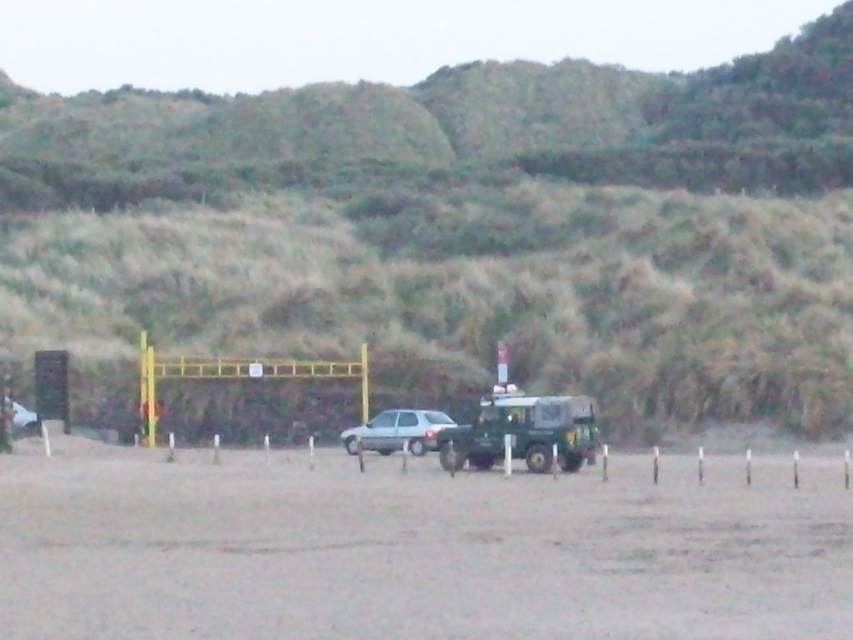
You need to park your car between the two vehicles in the image. The green matte jeep at center and the satin silver car at center. Which side should you park on to be between them?

To park between the green matte jeep at center and the satin silver car at center, you should park on the left side of the green matte jeep at center since it is positioned to the right of the satin silver car at center.